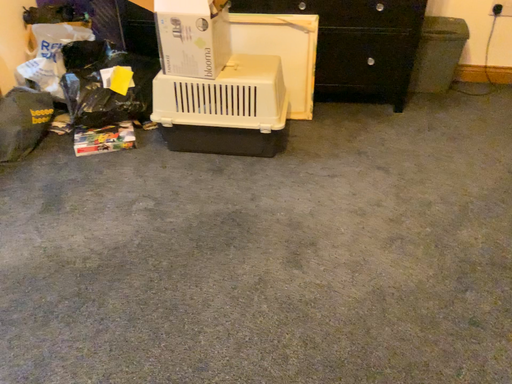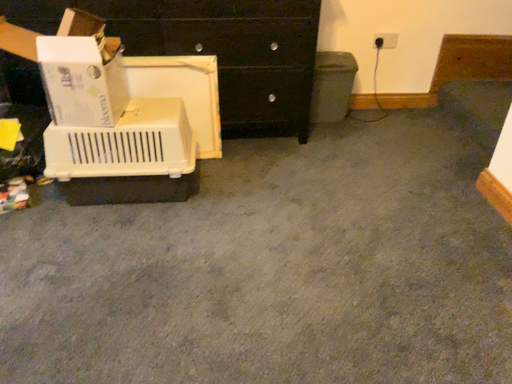
Question: Which way did the camera rotate in the video?

Choices:
 (A) rotated right
 (B) rotated left

Answer: (A)